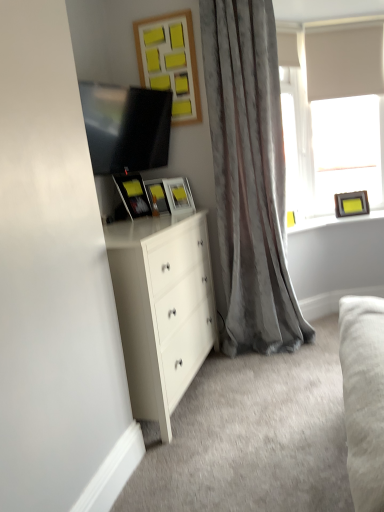
The height and width of the screenshot is (512, 384). Identify the location of vacant area that is in front of matte white picture frame at center, arranged as the 4th picture frame when viewed from the right. (167, 215).